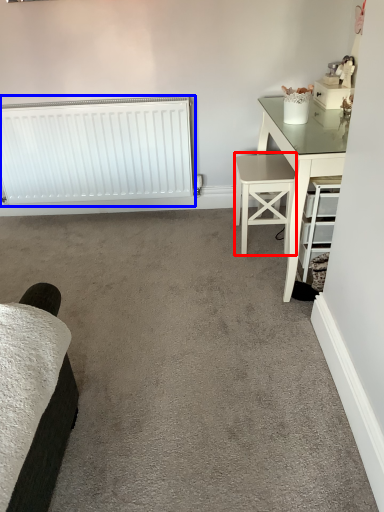
Question: Which of the following is the farthest to the observer, stool (highlighted by a red box) or radiator (highlighted by a blue box)?

Choices:
 (A) stool
 (B) radiator

Answer: (B)